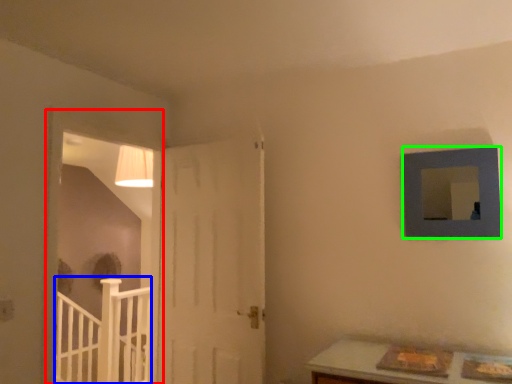
Question: Based on their relative distances, which object is nearer to window frame (highlighted by a red box)? Choose from rail (highlighted by a blue box) and picture frame (highlighted by a green box).

Choices:
 (A) rail
 (B) picture frame

Answer: (A)